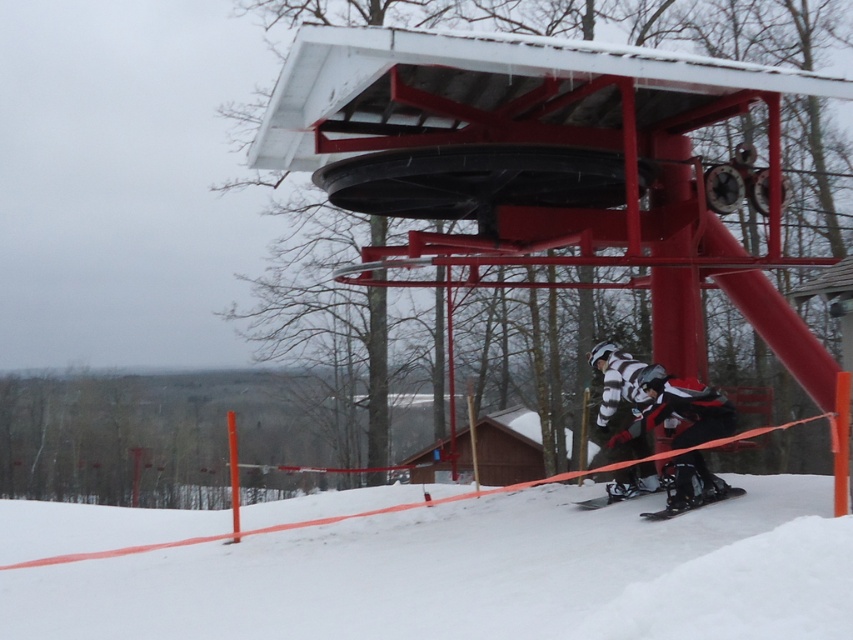
Question: Can you confirm if white powdery snow at lower center is positioned to the left of white matte ski suit at center?

Choices:
 (A) no
 (B) yes

Answer: (B)

Question: Estimate the real-world distances between objects in this image. Which object is farther from the white powdery snow at lower center?

Choices:
 (A) black matte snowboard at lower center
 (B) shiny black ski at lower center

Answer: (A)

Question: Which of the following is the farthest from the observer?

Choices:
 (A) (598, 500)
 (B) (703, 490)
 (C) (637, 387)
 (D) (708, 490)

Answer: (A)

Question: Does white matte ski suit at center appear on the right side of striped fabric snowsuit at center?

Choices:
 (A) yes
 (B) no

Answer: (A)

Question: Is white matte ski suit at center thinner than shiny black ski at lower center?

Choices:
 (A) no
 (B) yes

Answer: (A)

Question: Which object is positioned closest to the white powdery snow at lower center?

Choices:
 (A) black matte snowboard at lower center
 (B) shiny black ski at lower center
 (C) white matte ski suit at center
 (D) striped fabric snowsuit at center

Answer: (C)